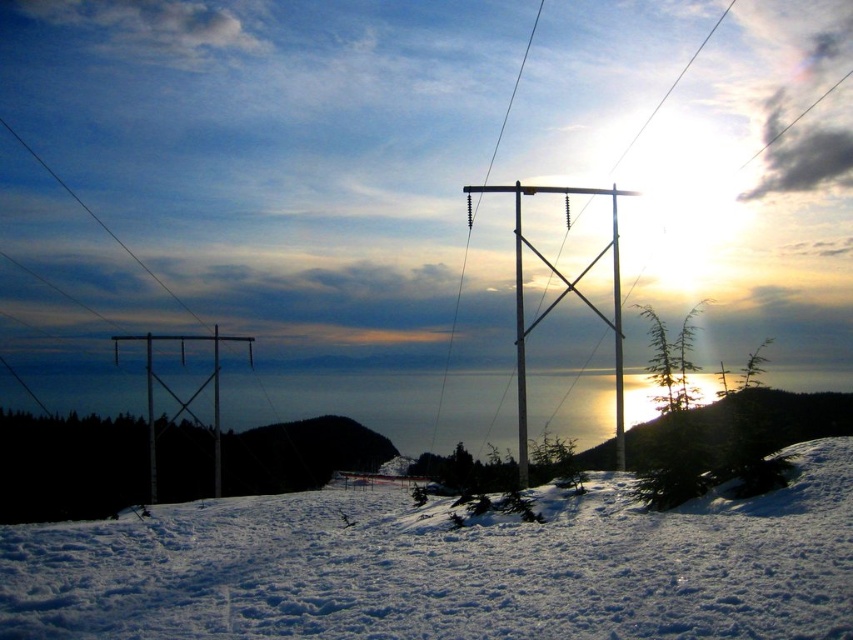
Question: Which object is the closest to the metallic silver telegraph pole at left?

Choices:
 (A) white fluffy snow at center
 (B) metallic silver pole at center

Answer: (B)

Question: Does white fluffy snow at center appear on the left side of metallic silver telegraph pole at center?

Choices:
 (A) no
 (B) yes

Answer: (B)

Question: Which object is positioned closest to the metallic silver telegraph pole at center?

Choices:
 (A) metallic silver telegraph pole at left
 (B) metallic silver pole at center

Answer: (B)

Question: Which object is closer to the camera taking this photo?

Choices:
 (A) metallic silver telegraph pole at center
 (B) white fluffy snow at center

Answer: (B)

Question: Is metallic silver telegraph pole at center positioned behind metallic silver telegraph pole at left?

Choices:
 (A) no
 (B) yes

Answer: (A)

Question: Can you confirm if metallic silver telegraph pole at left is thinner than metallic silver pole at center?

Choices:
 (A) yes
 (B) no

Answer: (B)